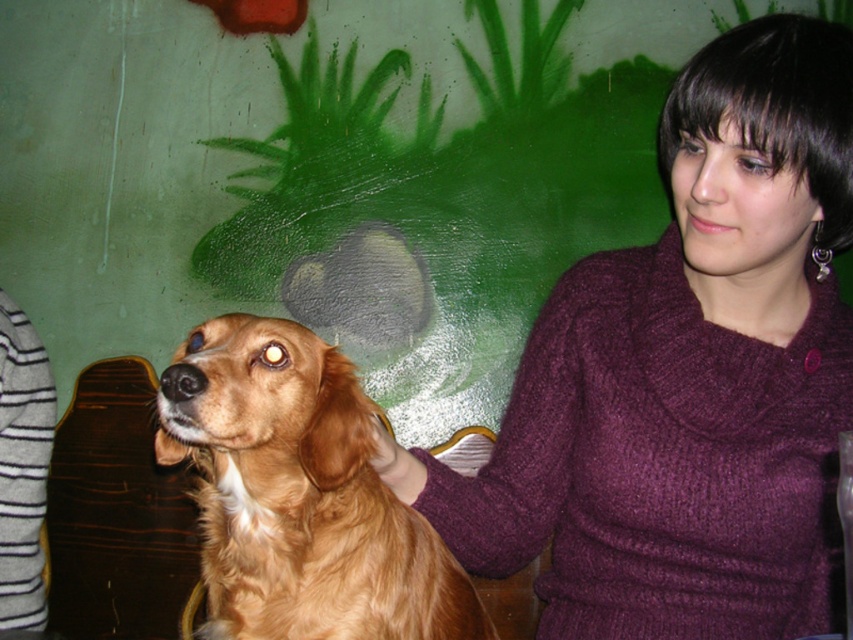
Does point (759, 484) lie behind point (186, 392)?

Yes, point (759, 484) is farther from viewer.

Is point (735, 115) more distant than point (253, 448)?

That is True.

Identify the location of knitted purple sweater at center. The image size is (853, 640). (688, 376).